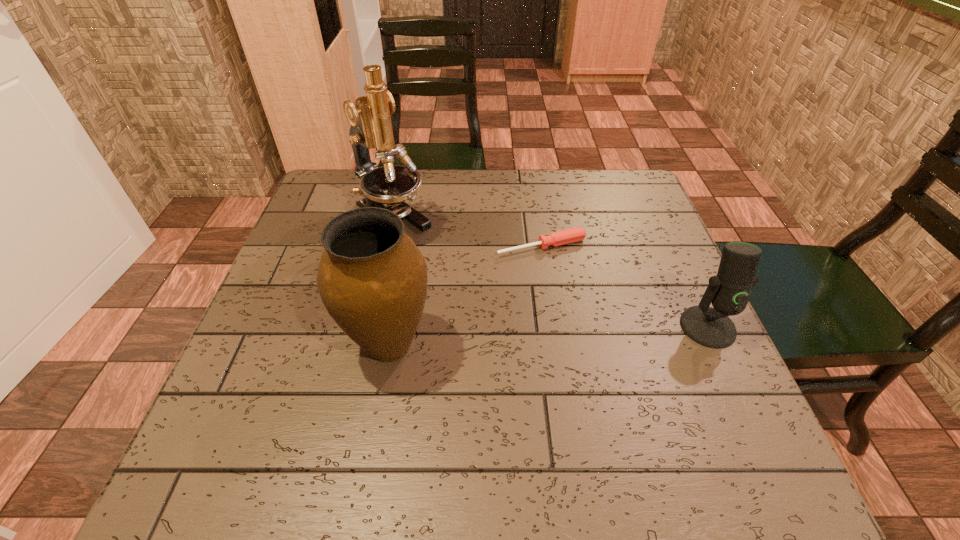
Locate an element on the screen. The width and height of the screenshot is (960, 540). vacant space located 0.370m at the eyepiece of the microscope is located at coordinates (531, 333).

Find the location of a particular element. The width and height of the screenshot is (960, 540). vacant space located at the blade of the shortest object is located at coordinates (625, 356).

The height and width of the screenshot is (540, 960). I want to click on free region located 0.350m at the blade of the shortest object, so click(x=642, y=383).

Identify the location of vacant region located 0.380m at the blade of the shortest object. (652, 397).

Identify the location of object positioned at the far edge. (387, 187).

The width and height of the screenshot is (960, 540). I want to click on object that is at the near edge, so click(x=372, y=279).

I want to click on object present at the left edge, so click(x=387, y=187).

I want to click on object that is at the right edge, so (x=728, y=291).

Locate an element on the screen. This screenshot has height=540, width=960. object located at the far left corner is located at coordinates (387, 187).

In the image, there is a desktop. Where is `vacant region at the far edge`? Image resolution: width=960 pixels, height=540 pixels. vacant region at the far edge is located at coordinates (572, 206).